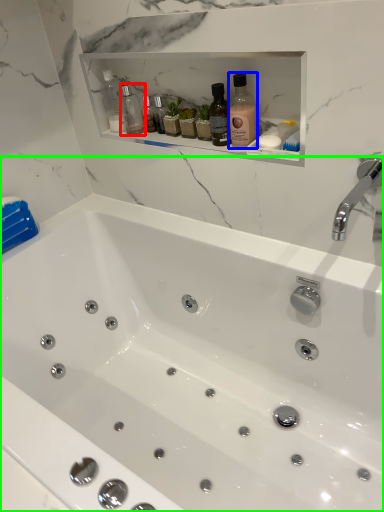
Question: Considering the real-world distances, which object is farthest from bottle (highlighted by a red box)? bottle (highlighted by a blue box) or bathtub (highlighted by a green box)?

Choices:
 (A) bottle
 (B) bathtub

Answer: (B)